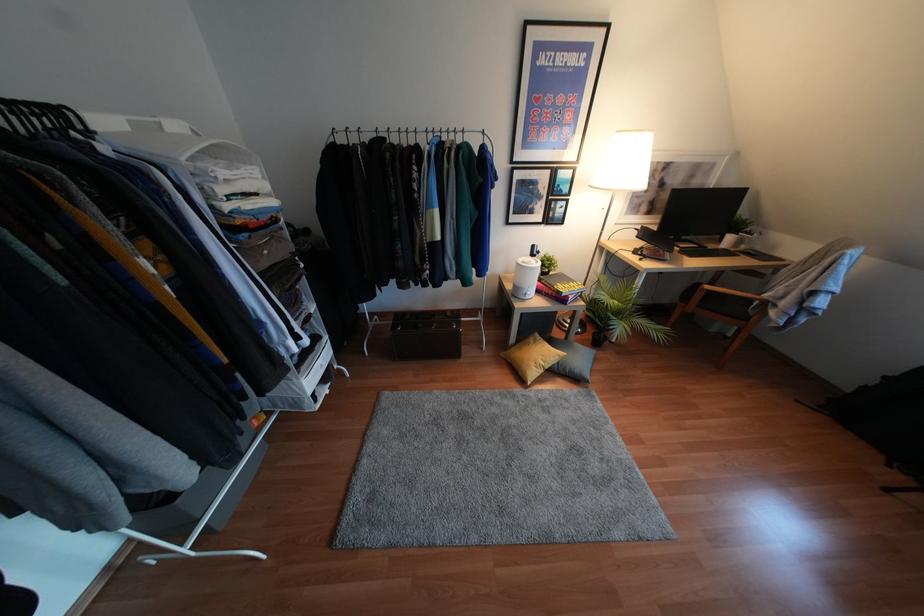
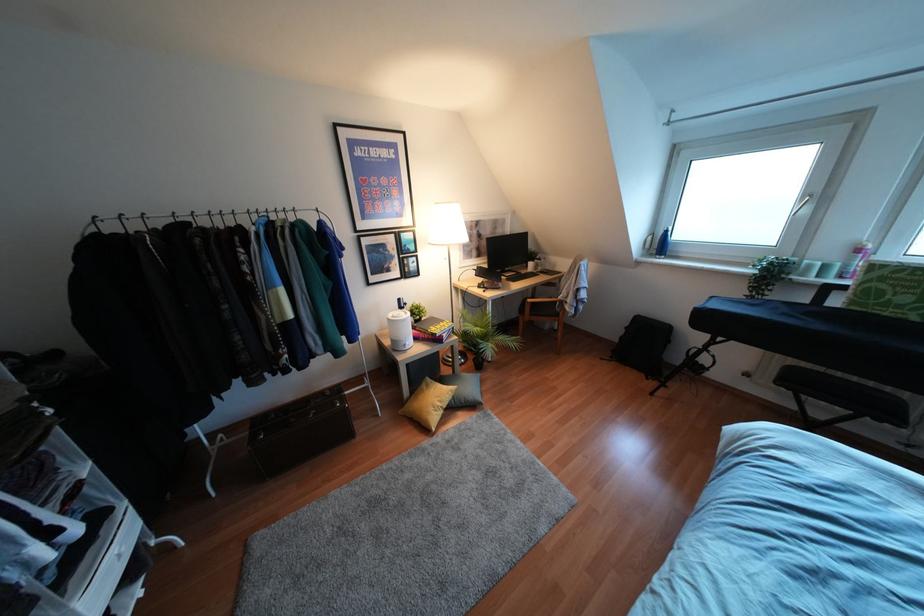
Find the pixel in the second image that matches (556,362) in the first image.

(453, 397)